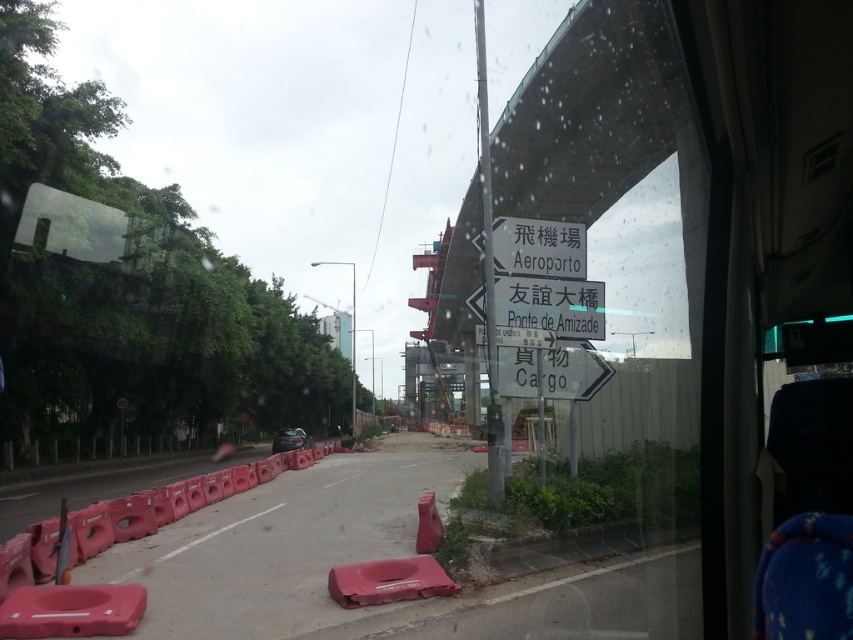
You are a passenger on a bus and notice the rubberized plastic barriers at lower left and the white paper sign at center outside the window. Which object is closer to you as you look through the window?

The rubberized plastic barriers at lower left are closer to you because they are positioned in front of the white paper sign at center, meaning they are nearer to the window from which you are observing.